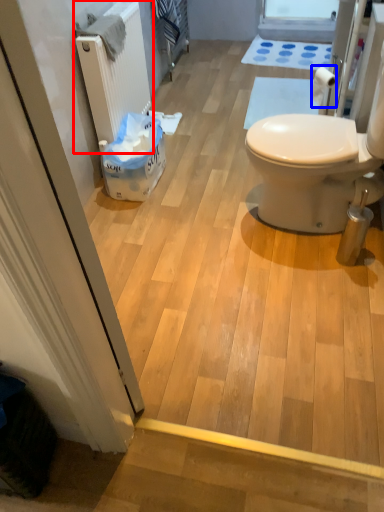
Question: Which object appears closest to the camera in this image, radiator (highlighted by a red box) or toilet paper (highlighted by a blue box)?

Choices:
 (A) radiator
 (B) toilet paper

Answer: (A)